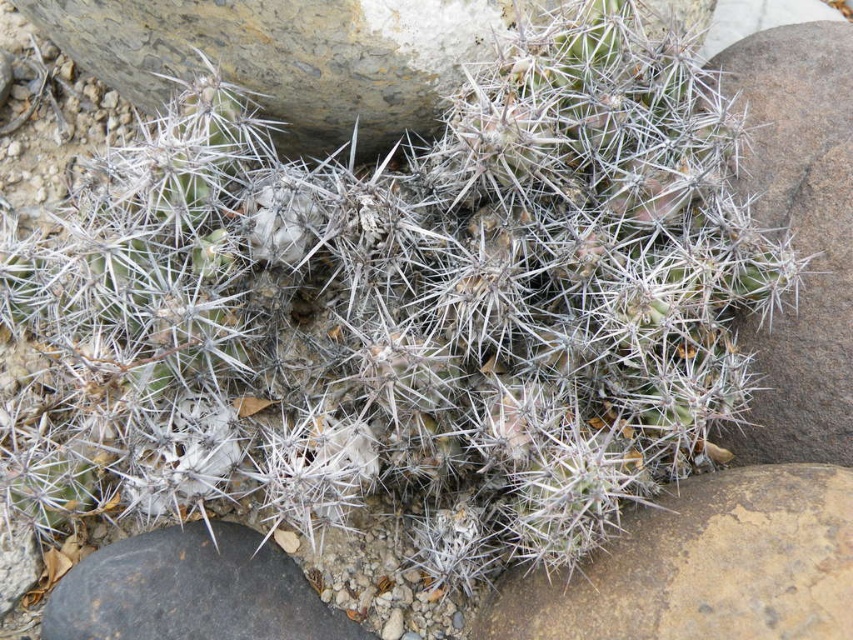
Question: Which point is farther from the camera taking this photo?

Choices:
 (A) (73, 564)
 (B) (732, 609)

Answer: (A)

Question: Among these points, which one is farthest from the camera?

Choices:
 (A) (245, 636)
 (B) (708, 577)

Answer: (A)

Question: Does brown rough stone at lower right have a greater width compared to gray rough stone at lower left?

Choices:
 (A) no
 (B) yes

Answer: (B)

Question: From the image, what is the correct spatial relationship of brown rough stone at lower right in relation to gray rough stone at lower left?

Choices:
 (A) right
 (B) left

Answer: (A)

Question: Is brown rough stone at lower right below gray rough stone at lower left?

Choices:
 (A) yes
 (B) no

Answer: (B)